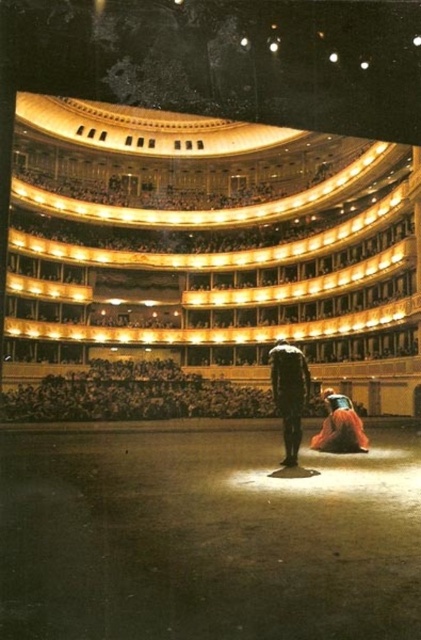
You are an usher at the theater and need to guide a guest to their seat. The guest asks where the velvet orange dress at lower right is in relation to the black matte suit at center. How would you describe their positions?

The black matte suit at center is to the left of the velvet orange dress at lower right, so the velvet orange dress at lower right is positioned to the right of the black matte suit at center.

You are sitting in the front row of the theater and notice two points marked on the stage floor. The first point is at coordinates point (293, 417) and the second is at point (351, 403). Which point is closer to you?

Point (293, 417) is closer to the camera than point (351, 403), so the first point is closer to you.